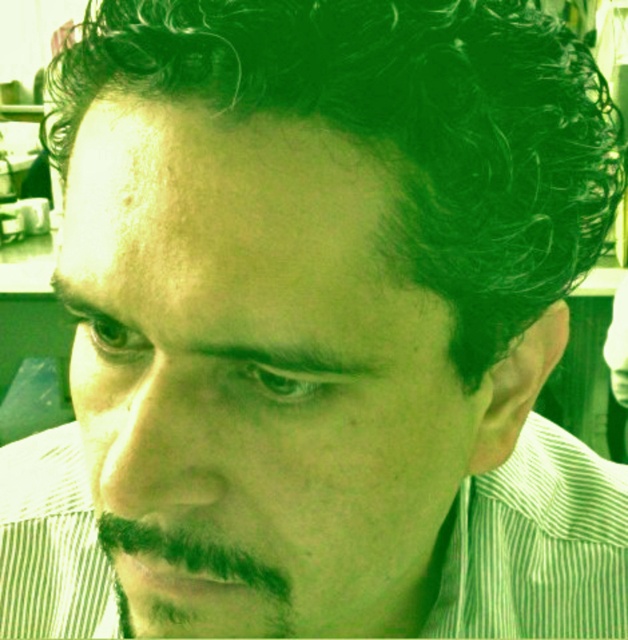
Based on the photo, you are standing in a room and see two points in the image. The first point is at coordinates point (382, 118) and the second is at point (284, 595). Which point is closer to you?

Point (382, 118) is in front of point (284, 595), so it is closer to you.

You are a photographer standing in front of a person with dark curly hair at upper center. You want to take a portrait but need to ensure you are at a safe distance. If the minimum safe distance for a clear photo is 10 inches, can you take the photo from your current position?

The dark curly hair at upper center and viewer are 8.83 inches apart, which is less than the minimum safe distance of 10 inches. Therefore, you need to move back to ensure a clear photo.